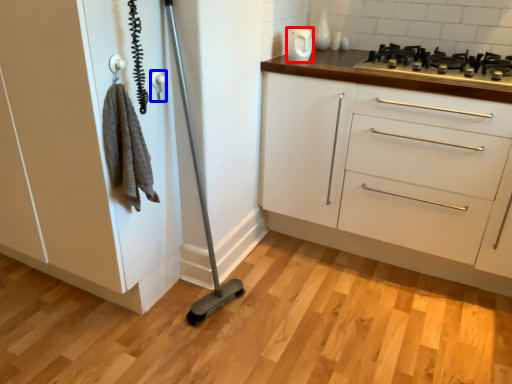
Question: Which of the following is the farthest to the observer, appliance (highlighted by a red box) or door handle (highlighted by a blue box)?

Choices:
 (A) appliance
 (B) door handle

Answer: (A)